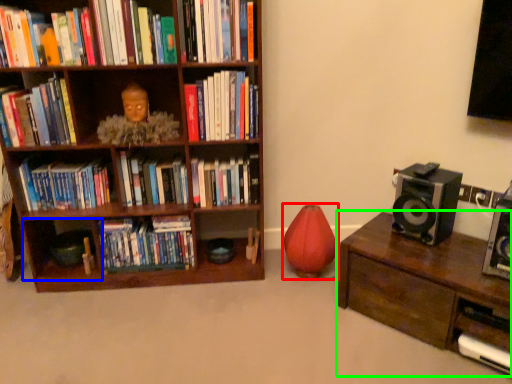
Question: Estimate the real-world distances between objects in this image. Which object is closer to toy (highlighted by a red box), shelf (highlighted by a blue box) or table (highlighted by a green box)?

Choices:
 (A) shelf
 (B) table

Answer: (B)